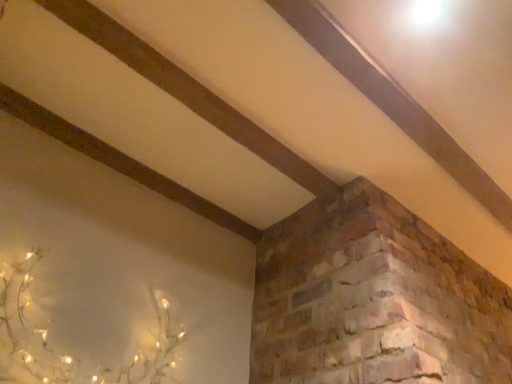
Question: Relative to smooth wooden plank at upper center, is ivory matte plant at lower left in front or behind?

Choices:
 (A) behind
 (B) front

Answer: (B)

Question: Is ivory matte plant at lower left wider or thinner than smooth wooden plank at upper center?

Choices:
 (A) wide
 (B) thin

Answer: (A)

Question: From the image's perspective, is ivory matte plant at lower left above or below smooth wooden plank at upper center?

Choices:
 (A) above
 (B) below

Answer: (B)

Question: Is point (458, 165) positioned closer to the camera than point (9, 286)?

Choices:
 (A) farther
 (B) closer

Answer: (A)

Question: In terms of width, does smooth wooden plank at upper center look wider or thinner when compared to ivory matte plant at lower left?

Choices:
 (A) wide
 (B) thin

Answer: (B)

Question: Do you think smooth wooden plank at upper center is within ivory matte plant at lower left, or outside of it?

Choices:
 (A) outside
 (B) inside

Answer: (A)

Question: In the image, is smooth wooden plank at upper center on the left side or the right side of ivory matte plant at lower left?

Choices:
 (A) right
 (B) left

Answer: (A)